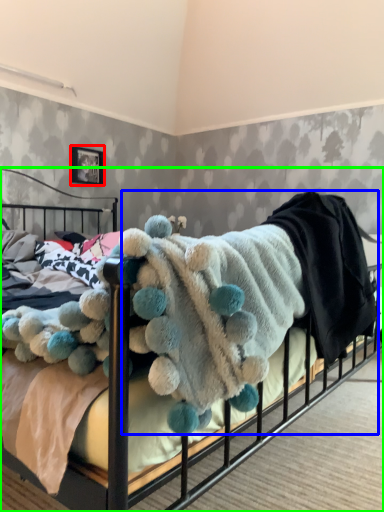
Question: Considering the real-world distances, which object is closest to picture frame (highlighted by a red box)? baby clothe (highlighted by a blue box) or bed (highlighted by a green box).

Choices:
 (A) baby clothe
 (B) bed

Answer: (A)